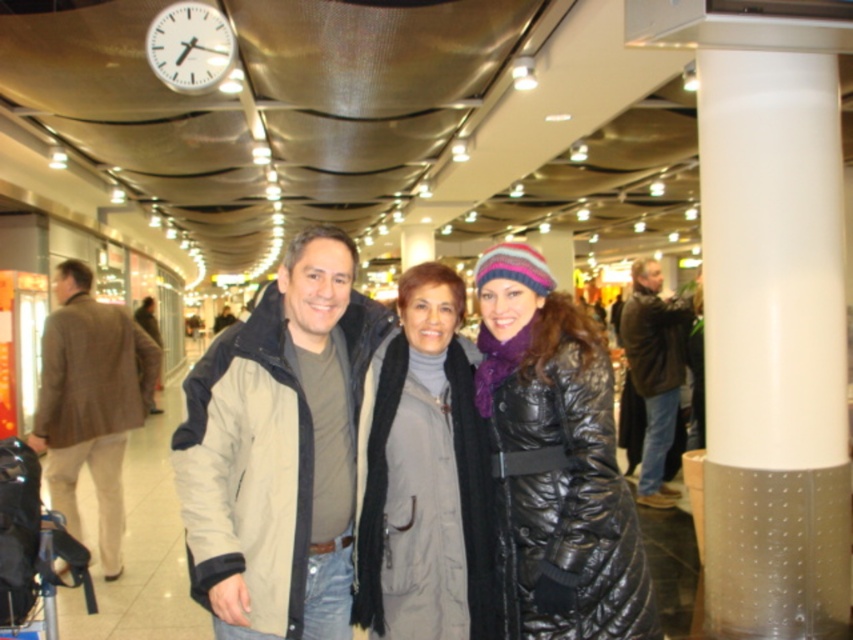
Does point (447, 276) lie behind point (651, 448)?

No, (447, 276) is closer to viewer.

Does matte beige jacket at center have a lesser height compared to brown leather jacket at right?

Yes, matte beige jacket at center is shorter than brown leather jacket at right.

Consider the image. Who is more forward, (x=252, y=320) or (x=665, y=429)?

Point (x=252, y=320) is more forward.

Where is `matte beige jacket at center`? This screenshot has width=853, height=640. matte beige jacket at center is located at coordinates (392, 464).

Who is positioned more to the left, beige fabric jacket at center or brown leather jacket at right?

Positioned to the left is beige fabric jacket at center.

Between beige fabric jacket at center and brown leather jacket at right, which one appears on the right side from the viewer's perspective?

From the viewer's perspective, brown leather jacket at right appears more on the right side.

Who is more forward, (355, 483) or (685, 332)?

Point (355, 483)

This screenshot has height=640, width=853. I want to click on beige fabric jacket at center, so [281, 449].

Which is below, shiny black coat at center or white plastic clock at upper left?

Positioned lower is shiny black coat at center.

Can you confirm if shiny black coat at center is positioned below white plastic clock at upper left?

Yes.

The height and width of the screenshot is (640, 853). What do you see at coordinates (555, 461) in the screenshot? I see `shiny black coat at center` at bounding box center [555, 461].

You are a GUI agent. You are given a task and a screenshot of the screen. Output one action in this format:
    pyautogui.click(x=<x>, y=<y>)
    Task: Click on the shiny black coat at center
    The width and height of the screenshot is (853, 640).
    Given the screenshot: What is the action you would take?
    pyautogui.click(x=555, y=461)